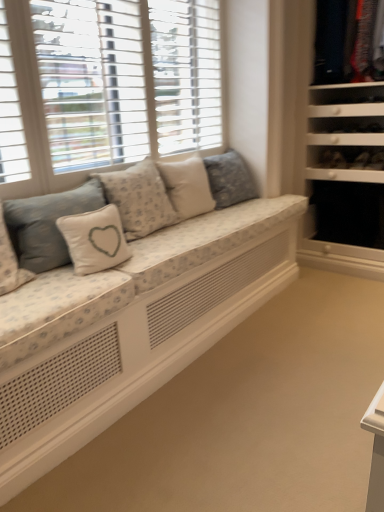
Question: Does point (100, 179) appear closer or farther from the camera than point (82, 224)?

Choices:
 (A) farther
 (B) closer

Answer: (A)

Question: Looking at the image, does floral fabric studio couch at center seem bigger or smaller compared to white fabric pillow with heart design at center, which is the second pillow in left-to-right order?

Choices:
 (A) small
 (B) big

Answer: (B)

Question: Based on their relative distances, which object is farther from the black fabric drawer at right?

Choices:
 (A) white fabric pillow with heart design at center, placed as the 1th pillow when sorted from left to right
 (B) white textured shutters at upper left
 (C) white fabric pillow at center, the third pillow positioned from the right
 (D) white fabric pillow with heart design at center, the 4th pillow in the right-to-left sequence
 (E) fluffy white pillow at center, the fifth pillow viewed from the left

Answer: (A)

Question: Which is nearer to the white textured shutters at upper left?

Choices:
 (A) black fabric drawer at right
 (B) white fabric pillow with heart design at center, the 4th pillow in the right-to-left sequence
 (C) floral fabric studio couch at center
 (D) white fabric pillow with heart design at center, which is the 5th pillow in right-to-left order
 (E) white fabric pillow at center, the third pillow positioned from the right

Answer: (E)